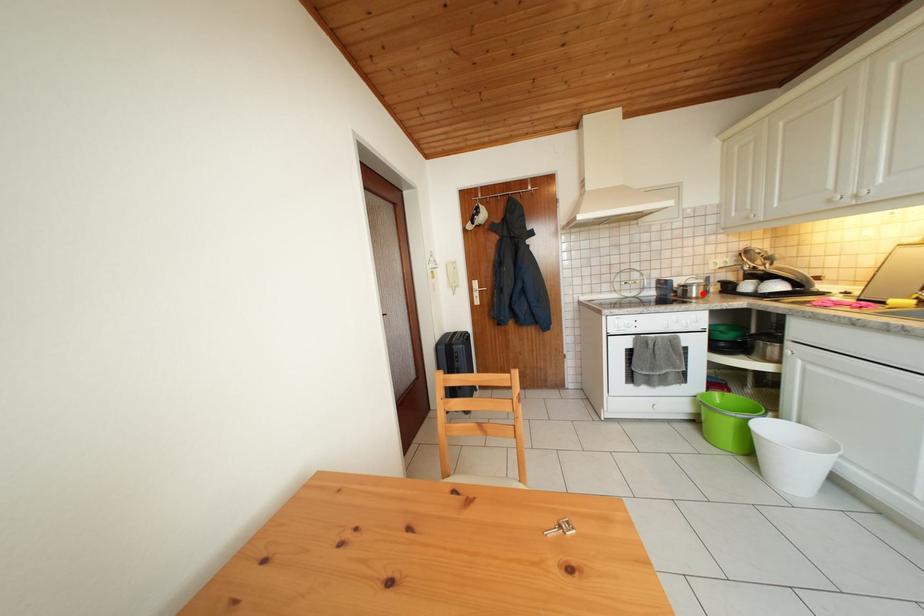
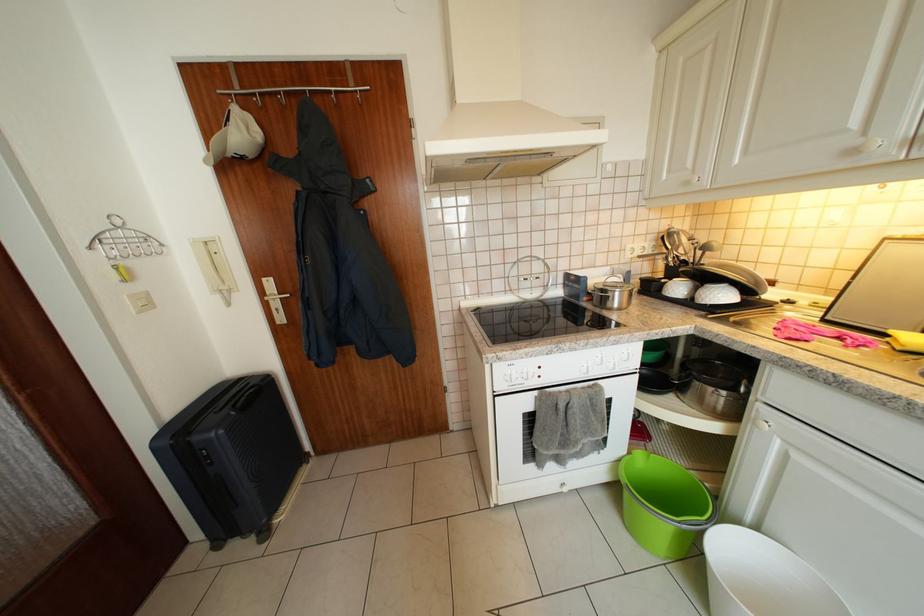
Locate, in the second image, the point that corresponds to the highlighted location in the first image.

(626, 299)